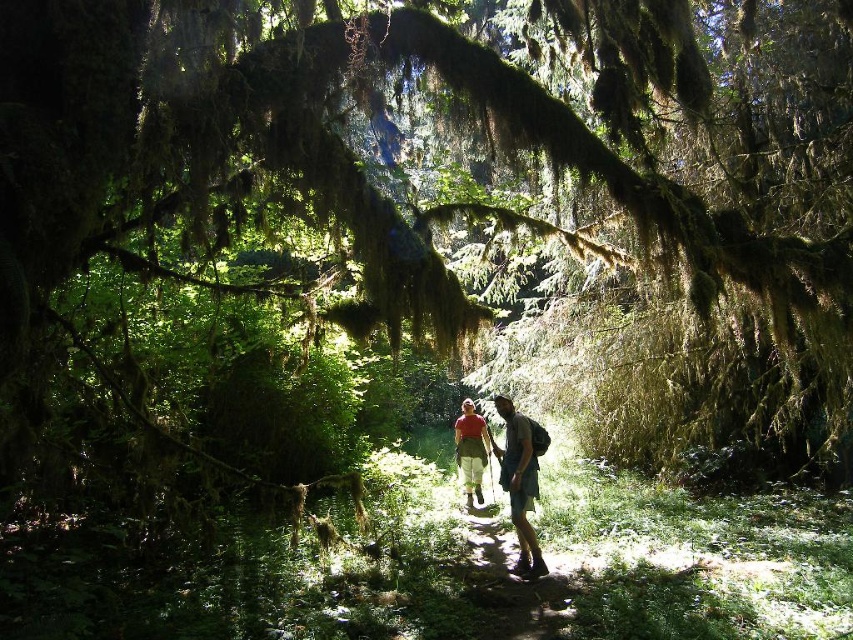
You are standing in the forest and see a person wearing a matte red shirt at center and matte green shorts at center. Which piece of clothing is positioned to the right?

The matte green shorts at center is to the right of the matte red shirt at center.

You are a hiker who has just arrived at the forest and wants to take a photo of yourself. You are wearing a matte green shorts at center and a matte red shirt at center. To ensure both items are clearly visible in the photo, which clothing item should you position closer to the camera?

The matte green shorts at center is much taller than the matte red shirt at center, so you should position the matte green shorts at center closer to the camera to ensure both items are clearly visible.

From the picture: You are standing in the forest and see the matte green shorts at center and the matte red shirt at center. If you want to reach both items, which one would you need to walk further to get to?

Both the matte green shorts at center and the matte red shirt at center are at the same distance from you since they are both at center, so you don not need to walk further for either.